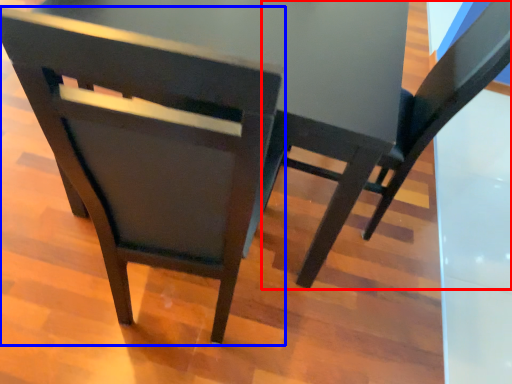
Question: Which object appears farthest to the camera in this image, chair (highlighted by a red box) or chair (highlighted by a blue box)?

Choices:
 (A) chair
 (B) chair

Answer: (A)